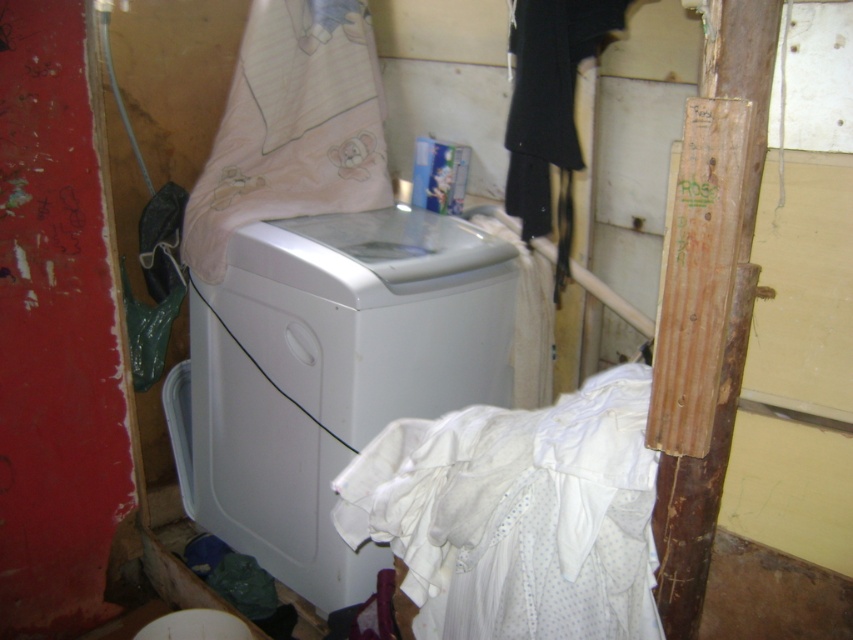
You are a laundry attendant who needs to separate the white cotton laundry at center and the pink fabric laundry at center into two baskets. The baskets are placed on opposite sides of the laundry area. Which laundry item should go into which basket based on their positions?

The white cotton laundry at center should go into the basket on the left side, and the pink fabric laundry at center should go into the basket on the right side, as they are positioned 33.69 inches apart from each other.

You are trying to place a small basket on the white plastic washing machine at center without it falling off. Considering the white cotton laundry at center is already on top, would the basket fit?

The white plastic washing machine at center is above the white cotton laundry at center, meaning the laundry is placed on top of the washing machine. Since the laundry is already occupying the space, the basket may not fit unless the laundry is moved aside.

You are trying to place a new laundry basket that is the same size as the white cotton laundry at center on top of the white plastic washing machine at center. Will it fit?

The white plastic washing machine at center is bigger than white cotton laundry at center, so the laundry basket will fit on top since the washing machine has enough space.